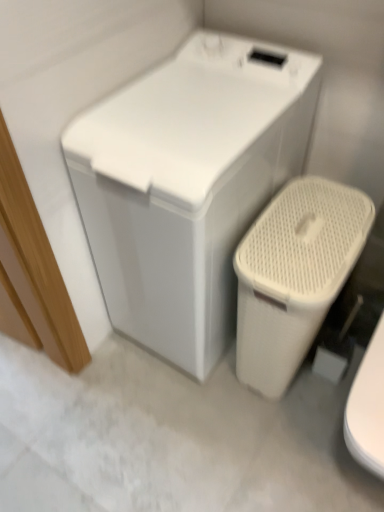
Question: Does white matte washing machine at upper center have a smaller size compared to beige textured plastic toilet at lower right?

Choices:
 (A) yes
 (B) no

Answer: (B)

Question: Is there a large distance between white matte washing machine at upper center and beige textured plastic toilet at lower right?

Choices:
 (A) yes
 (B) no

Answer: (B)

Question: From a real-world perspective, is white matte washing machine at upper center under beige textured plastic toilet at lower right?

Choices:
 (A) yes
 (B) no

Answer: (B)

Question: Is white matte washing machine at upper center not within beige textured plastic toilet at lower right?

Choices:
 (A) yes
 (B) no

Answer: (A)

Question: Does white matte washing machine at upper center have a greater width compared to beige textured plastic toilet at lower right?

Choices:
 (A) yes
 (B) no

Answer: (A)

Question: Is white matte washing machine at upper center to the left of beige textured plastic toilet at lower right from the viewer's perspective?

Choices:
 (A) no
 (B) yes

Answer: (B)

Question: Is beige textured plastic toilet at lower right oriented away from white matte washing machine at upper center?

Choices:
 (A) no
 (B) yes

Answer: (A)

Question: Considering the relative positions of beige textured plastic toilet at lower right and white matte washing machine at upper center in the image provided, is beige textured plastic toilet at lower right to the right of white matte washing machine at upper center from the viewer's perspective?

Choices:
 (A) yes
 (B) no

Answer: (A)

Question: Would you say beige textured plastic toilet at lower right is a long distance from white matte washing machine at upper center?

Choices:
 (A) no
 (B) yes

Answer: (A)

Question: Can you confirm if beige textured plastic toilet at lower right is shorter than white matte washing machine at upper center?

Choices:
 (A) yes
 (B) no

Answer: (A)

Question: Is beige textured plastic toilet at lower right oriented towards white matte washing machine at upper center?

Choices:
 (A) yes
 (B) no

Answer: (B)

Question: Would you say beige textured plastic toilet at lower right contains white matte washing machine at upper center?

Choices:
 (A) no
 (B) yes

Answer: (A)

Question: From the image's perspective, is white matte washing machine at upper center positioned above or below beige textured plastic toilet at lower right?

Choices:
 (A) below
 (B) above

Answer: (B)